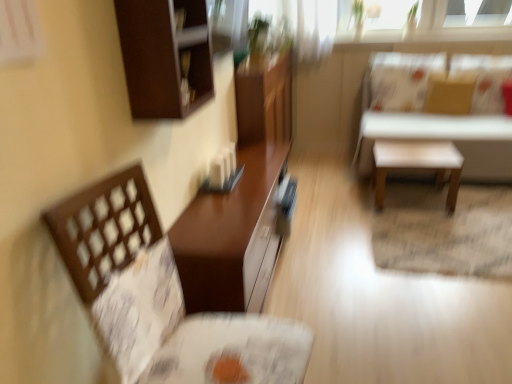
Question: From the image's perspective, is matte brown table at center, arranged as the first table when viewed from the front, above or below white matte stool at center?

Choices:
 (A) above
 (B) below

Answer: (B)

Question: In the image, is matte brown table at center, placed as the second table when sorted from right to left, positioned in front of or behind white matte stool at center?

Choices:
 (A) front
 (B) behind

Answer: (A)

Question: Which object is the closest to the dark brown wood cabinet at upper left?

Choices:
 (A) white matte stool at upper right, which is the second table from front to back
 (B) matte brown table at center, the 2th table positioned from the back
 (C) white matte stool at center
 (D) brown woven chair at left

Answer: (D)

Question: Estimate the real-world distances between objects in this image. Which object is farther from the matte brown table at center, which is the first table from left to right?

Choices:
 (A) dark brown wood cabinet at upper left
 (B) brown woven chair at left
 (C) white matte stool at center
 (D) white matte stool at upper right, acting as the second table starting from the left

Answer: (D)